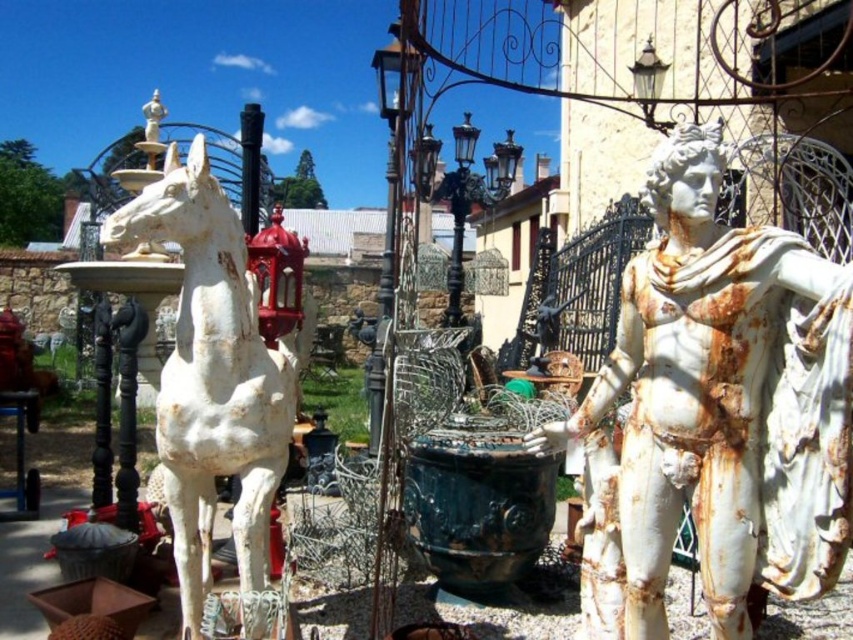
Question: Is white marble statue at center to the right of white matte horse at left from the viewer's perspective?

Choices:
 (A) yes
 (B) no

Answer: (A)

Question: In this image, where is white marble statue at center located relative to white matte horse at left?

Choices:
 (A) left
 (B) right

Answer: (B)

Question: Does white marble statue at center have a larger size compared to white matte horse at left?

Choices:
 (A) no
 (B) yes

Answer: (A)

Question: Among these objects, which one is farthest from the camera?

Choices:
 (A) white matte horse at left
 (B) white marble statue at center

Answer: (A)

Question: Which of the following is the closest to the observer?

Choices:
 (A) (114, 227)
 (B) (787, 438)

Answer: (B)